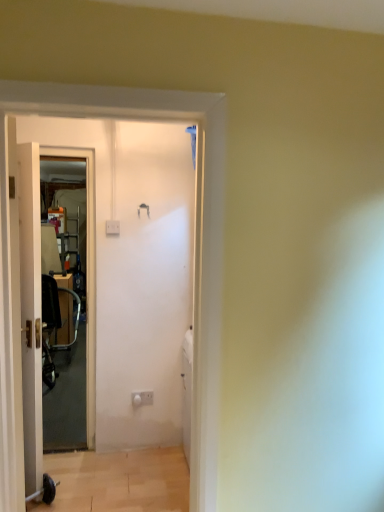
Question: Would you say wooden frame screen door at left contains metallic silver baby carriage at left?

Choices:
 (A) yes
 (B) no

Answer: (B)

Question: Does wooden frame screen door at left appear on the right side of metallic silver baby carriage at left?

Choices:
 (A) yes
 (B) no

Answer: (A)

Question: Is wooden frame screen door at left further to the viewer compared to metallic silver baby carriage at left?

Choices:
 (A) yes
 (B) no

Answer: (B)

Question: Considering the relative sizes of wooden frame screen door at left and metallic silver baby carriage at left in the image provided, is wooden frame screen door at left wider than metallic silver baby carriage at left?

Choices:
 (A) no
 (B) yes

Answer: (A)

Question: Can you confirm if wooden frame screen door at left is thinner than metallic silver baby carriage at left?

Choices:
 (A) no
 (B) yes

Answer: (B)

Question: In terms of width, does metallic silver baby carriage at left look wider or thinner when compared to white wooden door at left?

Choices:
 (A) wide
 (B) thin

Answer: (A)

Question: Which is correct: metallic silver baby carriage at left is inside white wooden door at left, or outside of it?

Choices:
 (A) inside
 (B) outside

Answer: (B)

Question: Based on their positions, is metallic silver baby carriage at left located to the left or right of white wooden door at left?

Choices:
 (A) left
 (B) right

Answer: (A)

Question: From the image's perspective, is metallic silver baby carriage at left positioned above or below white wooden door at left?

Choices:
 (A) below
 (B) above

Answer: (A)

Question: Is metallic silver baby carriage at left wider or thinner than wooden frame screen door at left?

Choices:
 (A) wide
 (B) thin

Answer: (A)

Question: Looking at the image, does metallic silver baby carriage at left seem bigger or smaller compared to wooden frame screen door at left?

Choices:
 (A) small
 (B) big

Answer: (B)

Question: In the image, is metallic silver baby carriage at left positioned in front of or behind wooden frame screen door at left?

Choices:
 (A) behind
 (B) front

Answer: (A)

Question: Is point (44, 346) closer or farther from the camera than point (87, 284)?

Choices:
 (A) farther
 (B) closer

Answer: (A)

Question: From a real-world perspective, is white plastic electric outlet at center positioned above or below wooden frame screen door at left?

Choices:
 (A) below
 (B) above

Answer: (A)

Question: Looking at their shapes, would you say white plastic electric outlet at center is wider or thinner than wooden frame screen door at left?

Choices:
 (A) thin
 (B) wide

Answer: (A)